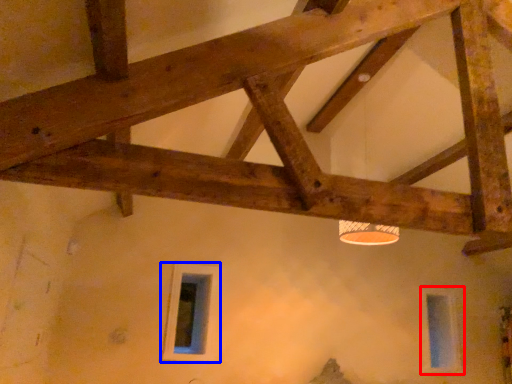
Question: Among these objects, which one is nearest to the camera, window (highlighted by a red box) or window (highlighted by a blue box)?

Choices:
 (A) window
 (B) window

Answer: (B)